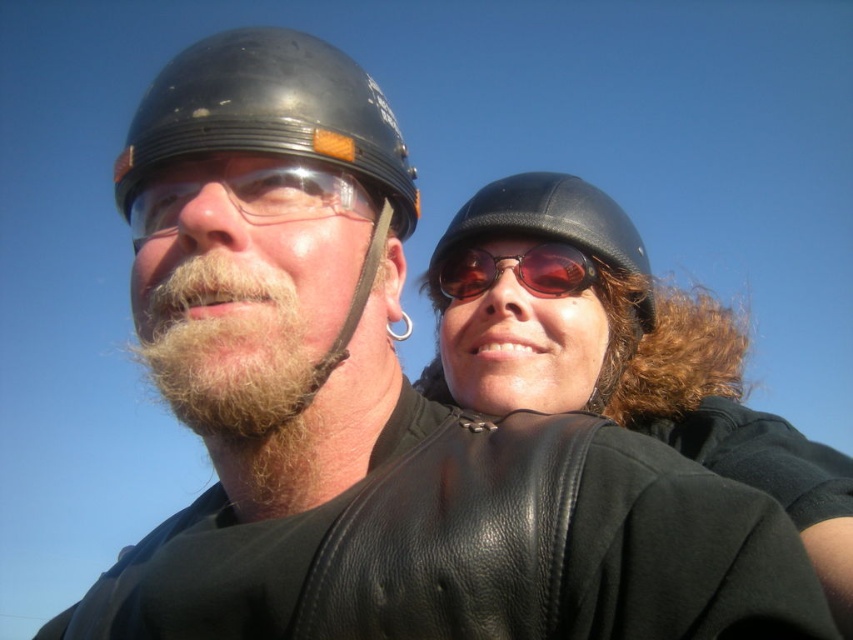
Question: Which object is the closest to the fuzzy brown beard at center?

Choices:
 (A) matte black goggles at left
 (B) glossy black helmet at left
 (C) black leather helmet at upper right
 (D) matte brown sunglasses at center

Answer: (A)

Question: Which object is farther from the camera taking this photo?

Choices:
 (A) matte brown sunglasses at center
 (B) black leather helmet at upper right

Answer: (A)

Question: Where is black leather helmet at upper right located in relation to matte brown sunglasses at center in the image?

Choices:
 (A) below
 (B) above

Answer: (B)

Question: Can you confirm if matte black helmet at upper right is positioned to the left of fuzzy brown beard at center?

Choices:
 (A) no
 (B) yes

Answer: (A)

Question: Which of the following is the farthest from the observer?

Choices:
 (A) black leather helmet at upper right
 (B) fuzzy brown beard at center

Answer: (A)

Question: Can you confirm if matte black helmet at upper right is positioned below matte brown sunglasses at center?

Choices:
 (A) yes
 (B) no

Answer: (A)